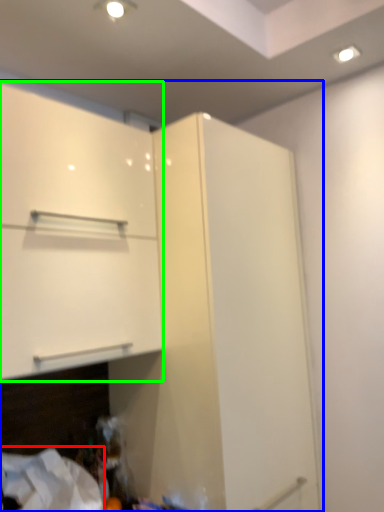
Question: Estimate the real-world distances between objects in this image. Which object is closer to sheet (highlighted by a red box), cupboard (highlighted by a blue box) or cabinetry (highlighted by a green box)?

Choices:
 (A) cupboard
 (B) cabinetry

Answer: (A)